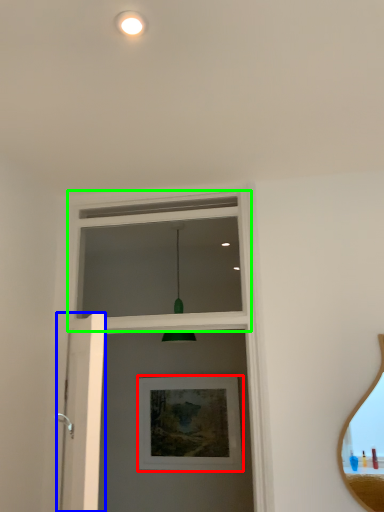
Question: Based on their relative distances, which object is farther from picture frame (highlighted by a red box)? Choose from screen door (highlighted by a blue box) and window frame (highlighted by a green box).

Choices:
 (A) screen door
 (B) window frame

Answer: (A)